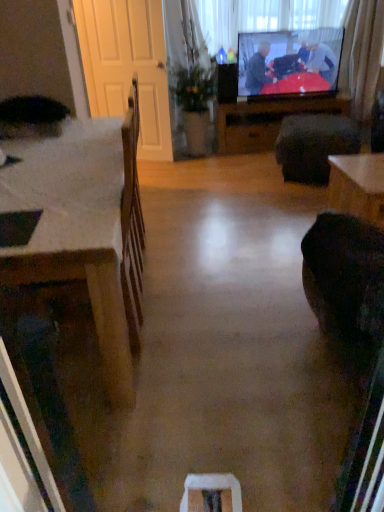
Question: In terms of height, does white wooden screen door at left look taller or shorter compared to curtain at upper right?

Choices:
 (A) tall
 (B) short

Answer: (A)

Question: In terms of size, does white wooden screen door at left appear bigger or smaller than curtain at upper right?

Choices:
 (A) big
 (B) small

Answer: (B)

Question: Which object is the closest to the white wooden screen door at left?

Choices:
 (A) transparent plastic window screen at upper center
 (B) curtain at upper right
 (C) dark fabric footrest at center
 (D) wooden table at lower right, which appears as the second table when viewed from the top
 (E) wooden desk at left

Answer: (A)

Question: Estimate the real-world distances between objects in this image. Which object is closer to the wooden table at lower right, the first table viewed from the front?

Choices:
 (A) curtain at upper right
 (B) dark fabric footrest at center
 (C) white wooden screen door at left
 (D) wooden table at center, positioned as the 2th table in front-to-back order
 (E) transparent plastic window screen at upper center

Answer: (B)